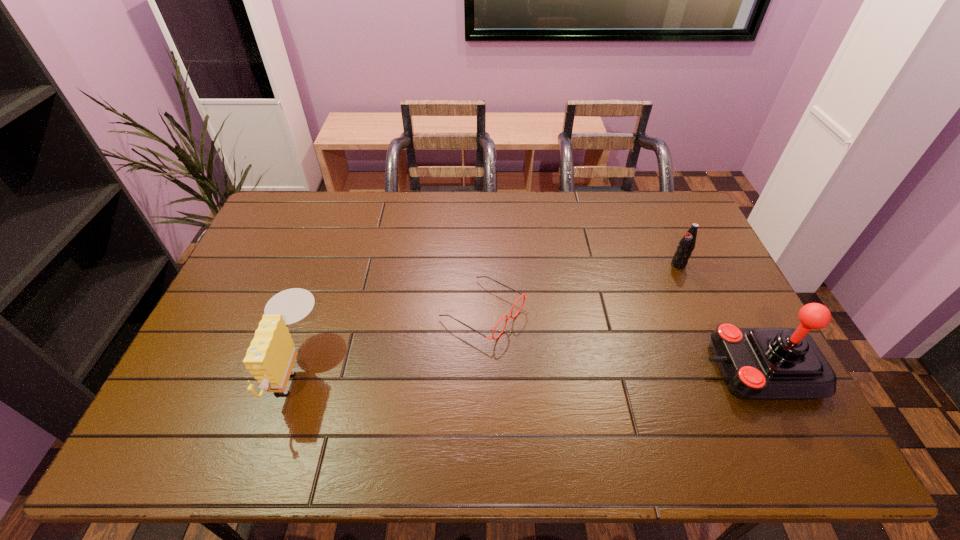
In order to click on the leftmost object in this screenshot , I will do `click(270, 358)`.

You are a GUI agent. You are given a task and a screenshot of the screen. Output one action in this format:
    pyautogui.click(x=<x>, y=<y>)
    Task: Click on the third shortest object
    
    Given the screenshot: What is the action you would take?
    tap(270, 358)

At what (x,y) coordinates should I click in order to perform the action: click on joystick. Please return your answer as a coordinate pair (x, y). This screenshot has width=960, height=540. Looking at the image, I should click on (756, 363).

At what (x,y) coordinates should I click in order to perform the action: click on spectacles. Please return your answer as a coordinate pair (x, y). The image size is (960, 540). Looking at the image, I should click on (525, 296).

Find the location of a particular element. the second object from left to right is located at coordinates (525, 296).

This screenshot has height=540, width=960. In order to click on the second shortest object in this screenshot , I will do `click(686, 245)`.

At what (x,y) coordinates should I click in order to perform the action: click on the farthest object. Please return your answer as a coordinate pair (x, y). Image resolution: width=960 pixels, height=540 pixels. Looking at the image, I should click on (686, 245).

At what (x,y) coordinates should I click in order to perform the action: click on free space located on the front-facing side of the sponge. Please return your answer as a coordinate pair (x, y). Looking at the image, I should click on (218, 369).

In order to click on vacant position located 0.120m on the front-facing side of the sponge in this screenshot , I will do tap(226, 369).

I want to click on vacant space situated on the front-facing side of the sponge, so click(x=196, y=369).